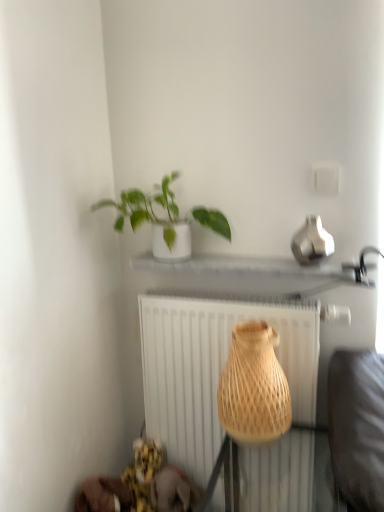
Locate an element on the screen. This screenshot has height=512, width=384. natural woven vase at center is located at coordinates (254, 386).

From a real-world perspective, which object rests below the other?

In real-world perspective, white textured radiator at center is lower.

Is natural woven vase at center positioned with its back to white textured radiator at center?

Yes, natural woven vase at center is facing away from white textured radiator at center.

Which of these two, natural woven vase at center or white textured radiator at center, is smaller?

With smaller size is natural woven vase at center.

Which of these two, natural woven vase at center or white textured radiator at center, is thinner?

With smaller width is white textured radiator at center.

From the image's perspective, which is below, green matte plant at upper center or natural woven vase at center?

From the image's view, natural woven vase at center is below.

In terms of height, does green matte plant at upper center look taller or shorter compared to natural woven vase at center?

Clearly, green matte plant at upper center is shorter compared to natural woven vase at center.

What's the angular difference between green matte plant at upper center and natural woven vase at center's facing directions?

The angle between the facing direction of green matte plant at upper center and the facing direction of natural woven vase at center is 0.0793 degrees.

Is point (170, 260) positioned after point (267, 377)?

Yes, it is behind point (267, 377).

Can you confirm if white textured radiator at center is bigger than natural woven vase at center?

Correct, white textured radiator at center is larger in size than natural woven vase at center.

Considering the sizes of white textured radiator at center and natural woven vase at center in the image, is white textured radiator at center wider or thinner than natural woven vase at center?

white textured radiator at center is thinner than natural woven vase at center.

From the image's perspective, who appears lower, white textured radiator at center or natural woven vase at center?

white textured radiator at center.

Can green matte plant at upper center be found inside natural woven vase at center?

No, green matte plant at upper center is not surrounded by natural woven vase at center.

Does point (275, 335) come farther from viewer compared to point (166, 188)?

No, it is not.

Does natural woven vase at center appear on the left side of green matte plant at upper center?

No, natural woven vase at center is not to the left of green matte plant at upper center.

Identify the location of vase lying in front of the green matte plant at upper center. (254, 386).

From the image's perspective, is white textured radiator at center located above or below green matte plant at upper center?

white textured radiator at center is below green matte plant at upper center.

Considering the sizes of objects white textured radiator at center and green matte plant at upper center in the image provided, who is taller, white textured radiator at center or green matte plant at upper center?

white textured radiator at center.

How much distance is there between white textured radiator at center and green matte plant at upper center?

The distance of white textured radiator at center from green matte plant at upper center is 15.79 inches.

Is green matte plant at upper center beside white textured radiator at center?

green matte plant at upper center is not next to white textured radiator at center, and they're not touching.

From the image's perspective, between green matte plant at upper center and white textured radiator at center, which one is located above?

green matte plant at upper center, from the image's perspective.

Could you tell me if green matte plant at upper center is turned towards white textured radiator at center?

No.

Is green matte plant at upper center bigger or smaller than white textured radiator at center?

In the image, green matte plant at upper center appears to be smaller than white textured radiator at center.

Find the location of a particular element. This screenshot has height=512, width=384. radiator below the natural woven vase at center (from a real-world perspective) is located at coordinates (213, 368).

Image resolution: width=384 pixels, height=512 pixels. I want to click on houseplant that is above the natural woven vase at center (from the image's perspective), so click(164, 219).

Based on their spatial positions, is green matte plant at upper center or white textured radiator at center further from natural woven vase at center?

The object further to natural woven vase at center is green matte plant at upper center.

Looking at the image, which one is located closer to natural woven vase at center, white textured radiator at center or green matte plant at upper center?

white textured radiator at center is positioned closer to the anchor natural woven vase at center.

Looking at the image, which one is located closer to white textured radiator at center, green matte plant at upper center or natural woven vase at center?

Based on the image, natural woven vase at center appears to be nearer to white textured radiator at center.

From the image, which object appears to be nearer to green matte plant at upper center, natural woven vase at center or white textured radiator at center?

white textured radiator at center is closer to green matte plant at upper center.

Considering their positions, is white textured radiator at center positioned further to green matte plant at upper center than natural woven vase at center?

natural woven vase at center lies further to green matte plant at upper center than the other object.

From the image, which object appears to be farther from white textured radiator at center, natural woven vase at center or green matte plant at upper center?

green matte plant at upper center.

Where is `vase between green matte plant at upper center and white textured radiator at center in the vertical direction`? vase between green matte plant at upper center and white textured radiator at center in the vertical direction is located at coordinates (254, 386).